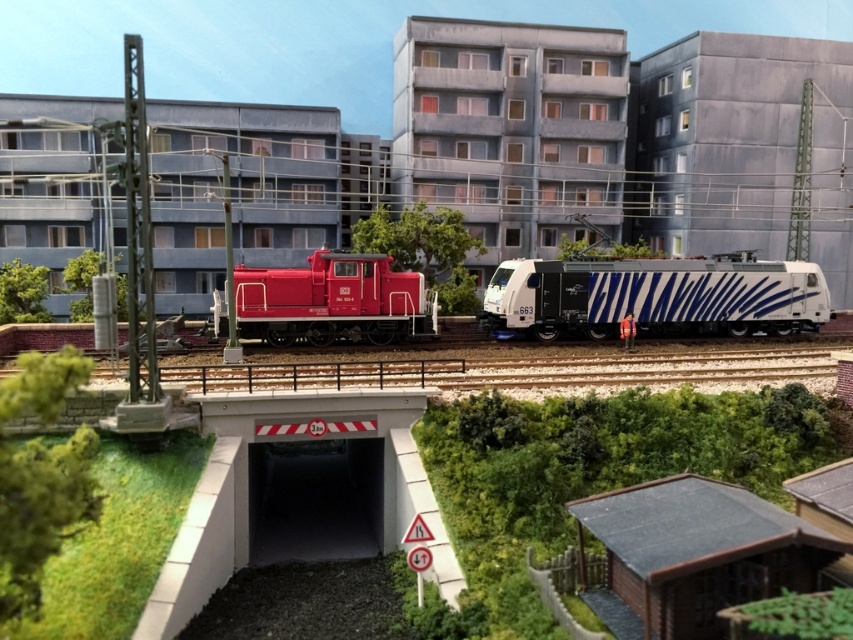
Question: Considering the relative positions of white glossy locomotive at center and matte red locomotive at center in the image provided, where is white glossy locomotive at center located with respect to matte red locomotive at center?

Choices:
 (A) below
 (B) above

Answer: (B)

Question: Can you confirm if white glossy locomotive at center is bigger than matte red locomotive at center?

Choices:
 (A) no
 (B) yes

Answer: (B)

Question: Which point is closer to the camera?

Choices:
 (A) white glossy locomotive at center
 (B) matte red locomotive at center

Answer: (B)

Question: Which point is farther to the camera?

Choices:
 (A) click(x=390, y=300)
 (B) click(x=525, y=316)

Answer: (B)

Question: Does white glossy locomotive at center appear on the right side of matte red locomotive at center?

Choices:
 (A) yes
 (B) no

Answer: (A)